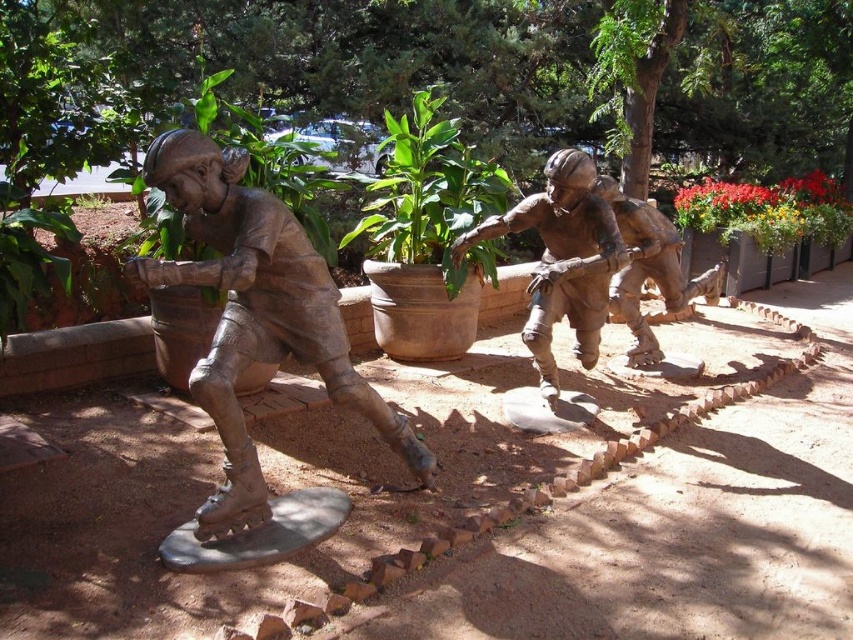
In the scene shown: You are holding a camera and want to take a photo of the bronze statue at center. If you are standing 4.15 meters away from the statue, which is the minimum distance you need to maintain to capture the entire statue in the frame?

The minimum distance you need to maintain is 4.15 meters because the bronze statue at center and camera are already 4.15 meters apart, which should allow the entire statue to be captured in the frame.

You are standing at the point marked as point [561,259] in the image. What object is located exactly at your current position?

The bronze statue at center is located exactly at point [561,259].

You are standing in front of the bronze sculpture of three children playing baseball. There are two points marked on the sculpture at coordinates point (546,200) and point (679,211). If you want to touch the point that is closer to you, which coordinate should you aim for?

You should aim for point (546,200) because it is closer to the camera than point (679,211).